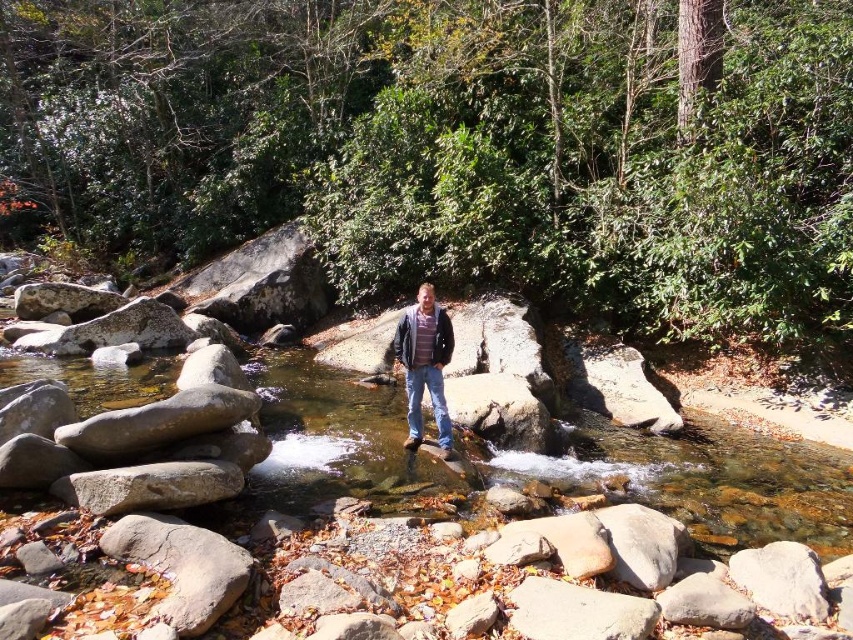
Question: Which point is closer to the camera?

Choices:
 (A) (426, 296)
 (B) (334, 403)

Answer: (A)

Question: Is clear water stream at center behind striped knit sweater at center?

Choices:
 (A) yes
 (B) no

Answer: (B)

Question: Can you confirm if clear water stream at center is positioned above striped knit sweater at center?

Choices:
 (A) yes
 (B) no

Answer: (B)

Question: Is clear water stream at center above striped knit sweater at center?

Choices:
 (A) yes
 (B) no

Answer: (B)

Question: Which point is closer to the camera?

Choices:
 (A) (740, 470)
 (B) (421, 348)

Answer: (B)